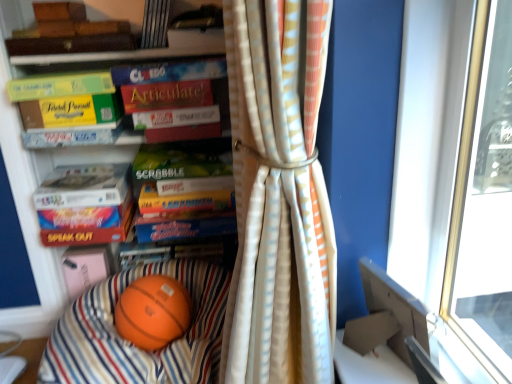
How much space does matte white paperback book at center, placed as the 3th paperback book when sorted from bottom to top, occupy vertically?

matte white paperback book at center, placed as the 3th paperback book when sorted from bottom to top, is 2.90 inches in height.

In order to face matte white paperback book at center, the 10th paperback book from the top, should I rotate leftwards or rightwards?

To align with it, rotate left about 21.479°.

Describe the element at coordinates (155, 24) in the screenshot. I see `hardcover book at upper center, the second book positioned from the back` at that location.

This screenshot has width=512, height=384. In order to click on brown cardboard book at upper left, which is the 12th paperback book in bottom-to-top order in this screenshot , I will do `click(71, 44)`.

At what (x,y) coordinates should I click in order to perform the action: click on matte white paperback book at center, the 10th paperback book from the top. Please return your answer as a coordinate pair (x, y). This screenshot has width=512, height=384. Looking at the image, I should click on (84, 186).

Which object is positioned more to the left, matte red book at left, the 1th paperback book when ordered from bottom to top, or brown cardboard book at upper left, which is the 12th paperback book in bottom-to-top order?

matte red book at left, the 1th paperback book when ordered from bottom to top.

Is brown cardboard book at upper left, placed as the first paperback book when sorted from top to bottom, surrounded by matte red book at left, the 1th paperback book when ordered from bottom to top?

No.

How different are the orientations of matte red book at left, which ranks as the 12th paperback book in top-to-bottom order, and brown cardboard book at upper left, which is the 12th paperback book in bottom-to-top order, in degrees?

1.15 degrees.

Considering the relative positions of white striped curtain at center and green matte scrabble board game at center, marked as the ninth paperback book in a top-to-bottom arrangement, in the image provided, is white striped curtain at center to the right of green matte scrabble board game at center, marked as the ninth paperback book in a top-to-bottom arrangement, from the viewer's perspective?

Yes.

Does white striped curtain at center touch green matte scrabble board game at center, which is the fourth paperback book from bottom to top?

No, white striped curtain at center is not touching green matte scrabble board game at center, which is the fourth paperback book from bottom to top.

Considering the points (325, 187) and (211, 163), which point is in front, point (325, 187) or point (211, 163)?

Point (325, 187)

The width and height of the screenshot is (512, 384). I want to click on the 4th paperback book above the white striped curtain at center (from the image's perspective), so click(179, 163).

Is point (170, 1) behind point (326, 378)?

Yes, it is.

From the image's perspective, which is below, hardcover book at upper center, the second book positioned from the back, or white striped curtain at center?

From the image's view, white striped curtain at center is below.

Is hardcover book at upper center, the first book viewed from the top, directly adjacent to white striped curtain at center?

No.

From a real-world perspective, is hardcover book at upper center, which is the 3th book in bottom-to-top order, under white striped curtain at center?

Incorrect, from a real-world perspective, hardcover book at upper center, which is the 3th book in bottom-to-top order, is higher than white striped curtain at center.

Based on their positions, is hardcover book at upper center, which is the third book in back-to-front order, located to the left or right of green matte scrabble board game at center, which is the fourth paperback book from bottom to top?

From the image, it's evident that hardcover book at upper center, which is the third book in back-to-front order, is to the left of green matte scrabble board game at center, which is the fourth paperback book from bottom to top.

Between hardcover book at upper center, which is counted as the 2th book, starting from the top, and green matte scrabble board game at center, marked as the ninth paperback book in a top-to-bottom arrangement, which one has more height?

With more height is green matte scrabble board game at center, marked as the ninth paperback book in a top-to-bottom arrangement.

Can we say hardcover book at upper center, which is counted as the 2th book, starting from the top, lies outside green matte scrabble board game at center, which is the fourth paperback book from bottom to top?

Yes, hardcover book at upper center, which is counted as the 2th book, starting from the top, is located beyond the bounds of green matte scrabble board game at center, which is the fourth paperback book from bottom to top.

Would you say hardcover book at upper center, which is the third book in back-to-front order, is a long distance from green matte scrabble board game at center, which is the fourth paperback book from bottom to top?

Actually, hardcover book at upper center, which is the third book in back-to-front order, and green matte scrabble board game at center, which is the fourth paperback book from bottom to top, are a little close together.

Is brown cardboard book at upper left, placed as the first paperback book when sorted from top to bottom, not near hardcover book at center, which is the first book in back-to-front order?

They are positioned close to each other.

Considering the relative sizes of brown cardboard book at upper left, which is the 12th paperback book in bottom-to-top order, and hardcover book at center, which is counted as the 3th book, starting from the top, in the image provided, is brown cardboard book at upper left, which is the 12th paperback book in bottom-to-top order, wider than hardcover book at center, which is counted as the 3th book, starting from the top,?

Yes, brown cardboard book at upper left, which is the 12th paperback book in bottom-to-top order, is wider than hardcover book at center, which is counted as the 3th book, starting from the top.

Based on their sizes in the image, would you say brown cardboard book at upper left, which is the 12th paperback book in bottom-to-top order, is bigger or smaller than hardcover book at center, marked as the first book in a bottom-to-top arrangement?

Considering their sizes, brown cardboard book at upper left, which is the 12th paperback book in bottom-to-top order, takes up more space than hardcover book at center, marked as the first book in a bottom-to-top arrangement.

Which is behind, point (116, 41) or point (127, 263)?

Positioned behind is point (127, 263).

Can you confirm if green matte scrabble board game at center, which is the fourth paperback book from bottom to top, is wider than green matte book at upper left, which appears as the 3th paperback book when viewed from the top?

In fact, green matte scrabble board game at center, which is the fourth paperback book from bottom to top, might be narrower than green matte book at upper left, which appears as the 3th paperback book when viewed from the top.

Is the position of green matte scrabble board game at center, which is the fourth paperback book from bottom to top, more distant than that of green matte book at upper left, which appears as the 3th paperback book when viewed from the top?

Yes, it is.

Could you tell me if green matte scrabble board game at center, marked as the ninth paperback book in a top-to-bottom arrangement, is facing green matte book at upper left, which appears as the 3th paperback book when viewed from the top?

No, green matte scrabble board game at center, marked as the ninth paperback book in a top-to-bottom arrangement, is not oriented towards green matte book at upper left, which appears as the 3th paperback book when viewed from the top.

Considering the points (224, 155) and (66, 87), which point is in front, point (224, 155) or point (66, 87)?

The point (66, 87) is in front.

Considering the relative sizes of matte cardboard scrabble board game at center, which is the 11th paperback book in top-to-bottom order, and hardcover book at upper center, the 2th book in the front-to-back sequence, in the image provided, is matte cardboard scrabble board game at center, which is the 11th paperback book in top-to-bottom order, thinner than hardcover book at upper center, the 2th book in the front-to-back sequence,?

No.

Is matte cardboard scrabble board game at center, which is the 11th paperback book in top-to-bottom order, oriented towards hardcover book at upper center, which is the 3th book in bottom-to-top order?

No, matte cardboard scrabble board game at center, which is the 11th paperback book in top-to-bottom order, is not oriented towards hardcover book at upper center, which is the 3th book in bottom-to-top order.

Can you tell me how much matte cardboard scrabble board game at center, which is the 11th paperback book in top-to-bottom order, and hardcover book at upper center, the first book viewed from the top, differ in facing direction?

The angle between the facing direction of matte cardboard scrabble board game at center, which is the 11th paperback book in top-to-bottom order, and the facing direction of hardcover book at upper center, the first book viewed from the top, is 1.96 degrees.

Does matte cardboard scrabble board game at center, acting as the 2th paperback book starting from the bottom, lie in front of hardcover book at upper center, the second book positioned from the back?

No, the depth of matte cardboard scrabble board game at center, acting as the 2th paperback book starting from the bottom, is greater than that of hardcover book at upper center, the second book positioned from the back.

What are the coordinates of `the 2nd paperback book to the left of the brown cardboard book at upper left, which is the 12th paperback book in bottom-to-top order, counting from the anchor's position` in the screenshot? It's located at point(89,233).

At what (x,y) coordinates should I click in order to perform the action: click on curtain located on the right of green matte scrabble board game at center, marked as the ninth paperback book in a top-to-bottom arrangement. Please return your answer as a coordinate pair (x, y). Looking at the image, I should click on (278, 201).

Looking at the image, which one is located further to matte white paperback book at center, placed as the 3th paperback book when sorted from bottom to top, rubberized orange ball at lower left or matte cardboard scrabble board game at center, acting as the 2th paperback book starting from the bottom?

rubberized orange ball at lower left.

Estimate the real-world distances between objects in this image. Which object is closer to hardcover book at center, which is the 3th book from front to back, hardcover book at upper center, the 2th book in the front-to-back sequence, or white matte paper at center, the 7th paperback book positioned from the bottom?

The object closer to hardcover book at center, which is the 3th book from front to back, is white matte paper at center, the 7th paperback book positioned from the bottom.

Considering their positions, is orange rubber basketball at center positioned further to brown cardboard book at upper left, which is the 12th paperback book in bottom-to-top order, than matte white paperback book at center, which is counted as the seventh paperback book, starting from the top?

orange rubber basketball at center lies further to brown cardboard book at upper left, which is the 12th paperback book in bottom-to-top order, than the other object.

Consider the image. Considering their positions, is hardcover book at upper center, the 2th book in the front-to-back sequence, positioned closer to hardcover book at center, which is counted as the 3th book, starting from the top, than matte white paperback book at center, arranged as the 6th paperback book when ordered from the bottom?

matte white paperback book at center, arranged as the 6th paperback book when ordered from the bottom, is closer to hardcover book at center, which is counted as the 3th book, starting from the top.

Based on their spatial positions, is brown cardboard book at upper left, placed as the first paperback book when sorted from top to bottom, or matte white paperback book at center, arranged as the 6th paperback book when ordered from the bottom, closer to matte red book at left, which ranks as the 12th paperback book in top-to-bottom order?

Based on the image, matte white paperback book at center, arranged as the 6th paperback book when ordered from the bottom, appears to be nearer to matte red book at left, which ranks as the 12th paperback book in top-to-bottom order.

Based on their spatial positions, is hardcover book at upper center, the 2th book in the front-to-back sequence, or orange matte basketball at lower center closer to rubberized orange ball at lower left?

orange matte basketball at lower center lies closer to rubberized orange ball at lower left than the other object.

Considering their positions, is hardcover book at upper center, which is the third book in back-to-front order, positioned further to green matte book at upper left, placed as the 10th paperback book when sorted from bottom to top, than matte board game at upper center, the second paperback book when ordered from top to bottom?

The object further to green matte book at upper left, placed as the 10th paperback book when sorted from bottom to top, is hardcover book at upper center, which is the third book in back-to-front order.

Estimate the real-world distances between objects in this image. Which object is closer to green matte scrabble board game at center, which is the fourth paperback book from bottom to top, hardcover book at upper center, the second book positioned from the back, or rubberized orange ball at lower left?

hardcover book at upper center, the second book positioned from the back, is positioned closer to the anchor green matte scrabble board game at center, which is the fourth paperback book from bottom to top.

Image resolution: width=512 pixels, height=384 pixels. Identify the location of bookcase between matte green paperback book at left, which is counted as the 8th paperback book, starting from the top, and matte red board game at center, the 9th paperback book when ordered from bottom to top, from left to right. (33, 191).

You are a GUI agent. You are given a task and a screenshot of the screen. Output one action in this format:
    pyautogui.click(x=<x>, y=<y>)
    Task: Click on the bookcase between hardcover book at upper center, the second book positioned from the back, and rubberized orange ball at lower left from top to bottom
    
    Given the screenshot: What is the action you would take?
    pyautogui.click(x=33, y=191)

I want to click on bookcase between matte red board game at center, the 4th paperback book from the top, and orange rubber basketball at center vertically, so click(33, 191).

Where is `ball positioned between orange matte basketball at lower center and hardcover book at center, which is the first book in back-to-front order, from near to far`? This screenshot has height=384, width=512. ball positioned between orange matte basketball at lower center and hardcover book at center, which is the first book in back-to-front order, from near to far is located at coordinates (153, 312).